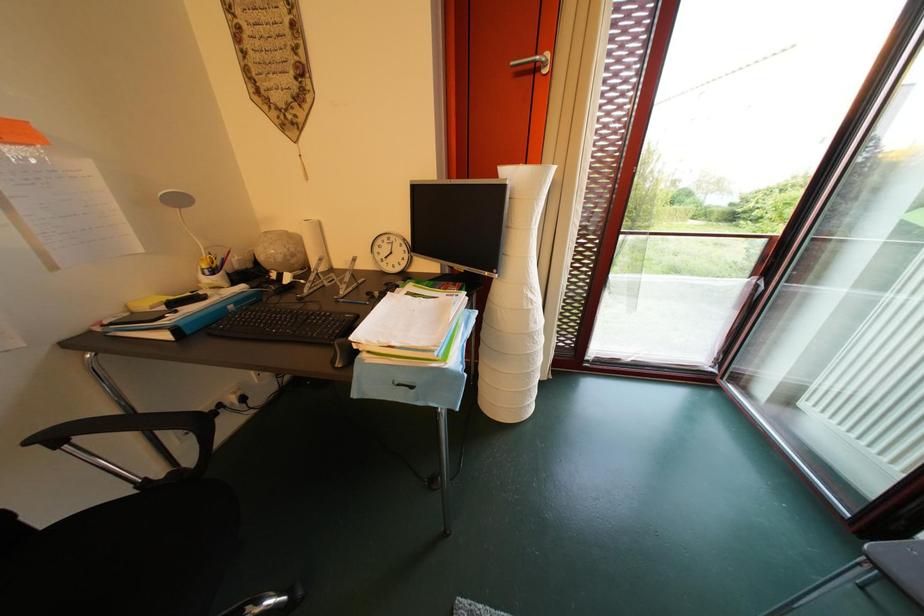
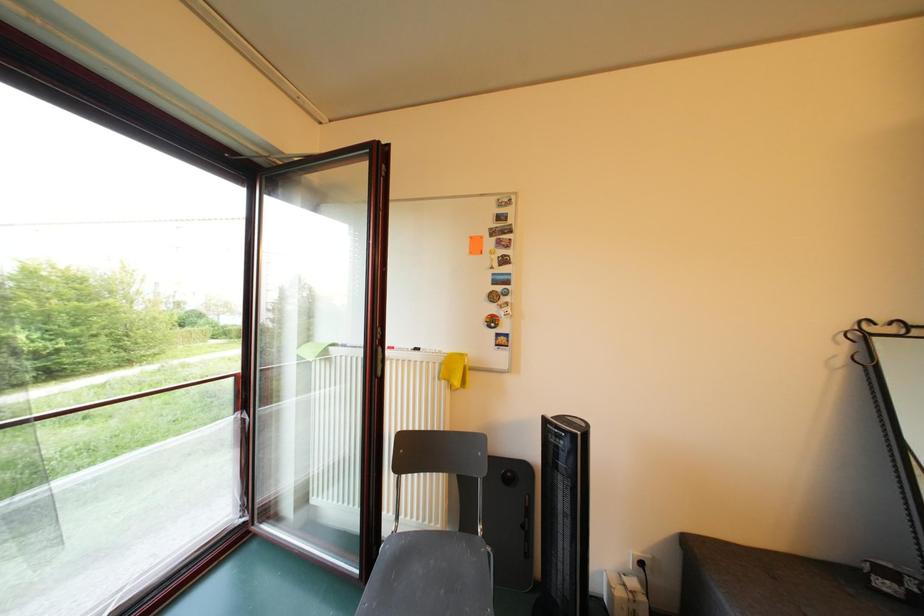
Question: How did the camera likely rotate?

Choices:
 (A) Left
 (B) Right
 (C) Up
 (D) Down

Answer: (B)